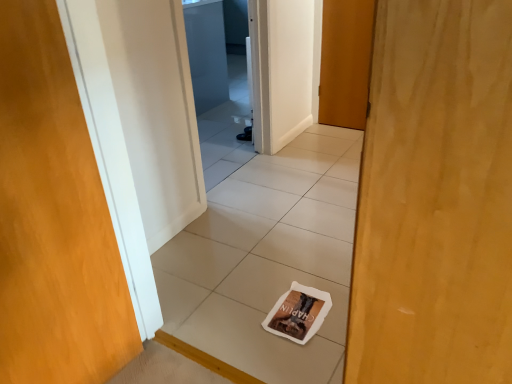
You are a GUI agent. You are given a task and a screenshot of the screen. Output one action in this format:
    pyautogui.click(x=<x>, y=<y>)
    Task: Click on the vacant area that is in front of brown paper magazine at center
    
    Given the screenshot: What is the action you would take?
    pyautogui.click(x=295, y=354)